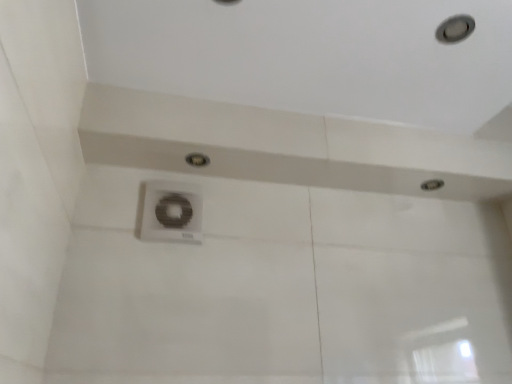
Question: Can you confirm if white plastic vent at center is positioned to the left of matte silver droplight at center, marked as the 1th droplight in a left-to-right arrangement?

Choices:
 (A) yes
 (B) no

Answer: (A)

Question: Can you confirm if white plastic vent at center is positioned to the right of matte silver droplight at center, marked as the 1th droplight in a left-to-right arrangement?

Choices:
 (A) no
 (B) yes

Answer: (A)

Question: From the image's perspective, is white plastic vent at center on top of matte silver droplight at center, the first droplight when ordered from front to back?

Choices:
 (A) yes
 (B) no

Answer: (B)

Question: Is white plastic vent at center located outside matte silver droplight at center, the 1th droplight from the top?

Choices:
 (A) no
 (B) yes

Answer: (B)

Question: Is matte silver droplight at center, marked as the 1th droplight in a left-to-right arrangement, located within white plastic vent at center?

Choices:
 (A) no
 (B) yes

Answer: (A)

Question: From a real-world perspective, does white plastic vent at center stand above matte silver droplight at center, the 1th droplight from the top?

Choices:
 (A) yes
 (B) no

Answer: (B)

Question: Does matte silver droplight at upper right, the first droplight in the back-to-front sequence, contain matte silver droplight at center, the 1th droplight from the top?

Choices:
 (A) yes
 (B) no

Answer: (B)

Question: Is the depth of matte silver droplight at upper right, arranged as the 2th droplight when viewed from the top, less than that of matte silver droplight at center, the first droplight when ordered from front to back?

Choices:
 (A) yes
 (B) no

Answer: (B)

Question: Is matte silver droplight at upper right, arranged as the 2th droplight when viewed from the top, thinner than matte silver droplight at center, the first droplight when ordered from front to back?

Choices:
 (A) no
 (B) yes

Answer: (A)

Question: Could you tell me if matte silver droplight at upper right, which appears as the first droplight when viewed from the right, is turned towards matte silver droplight at center, the 2th droplight in the right-to-left sequence?

Choices:
 (A) no
 (B) yes

Answer: (B)

Question: Considering the relative sizes of matte silver droplight at upper right, the first droplight ordered from the bottom, and matte silver droplight at center, the 2th droplight in the bottom-to-top sequence, in the image provided, is matte silver droplight at upper right, the first droplight ordered from the bottom, bigger than matte silver droplight at center, the 2th droplight in the bottom-to-top sequence,?

Choices:
 (A) yes
 (B) no

Answer: (B)

Question: Considering the relative positions of matte silver droplight at upper right, which appears as the first droplight when viewed from the right, and matte silver droplight at center, arranged as the 2th droplight when viewed from the back, in the image provided, is matte silver droplight at upper right, which appears as the first droplight when viewed from the right, behind matte silver droplight at center, arranged as the 2th droplight when viewed from the back,?

Choices:
 (A) yes
 (B) no

Answer: (A)

Question: Is matte silver droplight at center, the 1th droplight from the top, outside of white plastic vent at center?

Choices:
 (A) yes
 (B) no

Answer: (A)